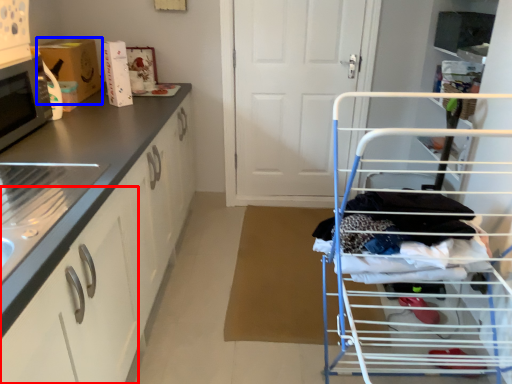
Question: Which object is further to the camera taking this photo, drawer (highlighted by a red box) or cardboard box (highlighted by a blue box)?

Choices:
 (A) drawer
 (B) cardboard box

Answer: (B)